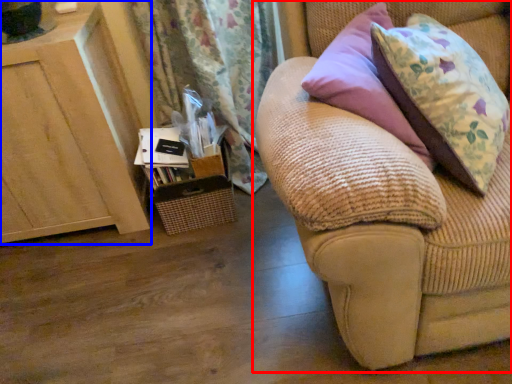
Question: Among these objects, which one is nearest to the camera, studio couch (highlighted by a red box) or furniture (highlighted by a blue box)?

Choices:
 (A) studio couch
 (B) furniture

Answer: (A)